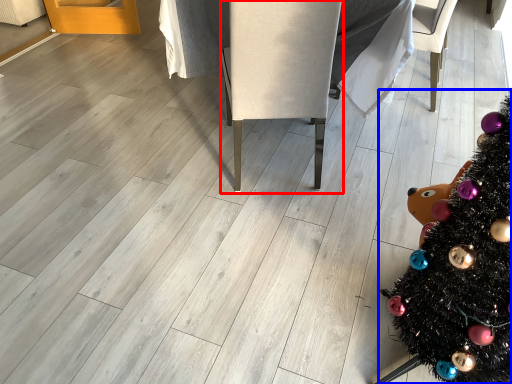
Question: Which point is further to the camera, armchair (highlighted by a red box) or christmas tree (highlighted by a blue box)?

Choices:
 (A) armchair
 (B) christmas tree

Answer: (A)